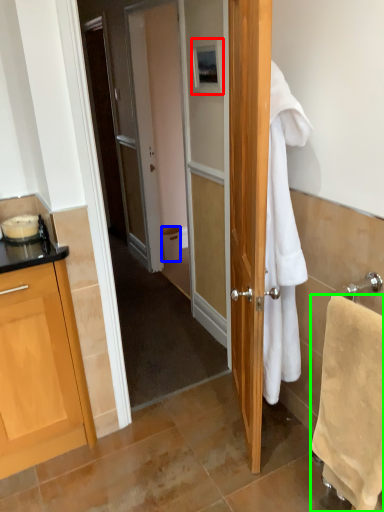
Question: Which object is positioned closest to picture frame (highlighted by a red box)? Select from trash bin/can (highlighted by a blue box) and towel/napkin (highlighted by a green box).

Choices:
 (A) trash bin/can
 (B) towel/napkin

Answer: (B)